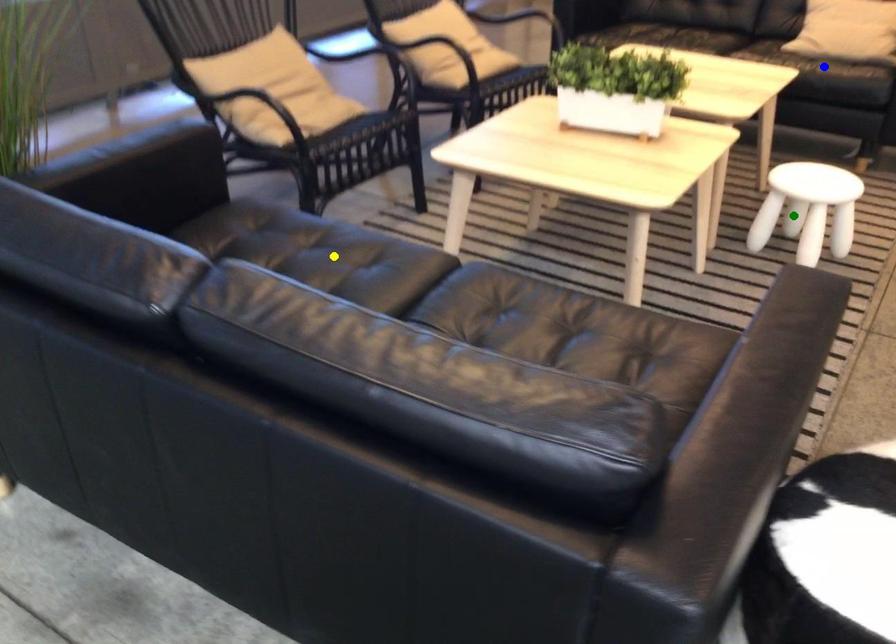
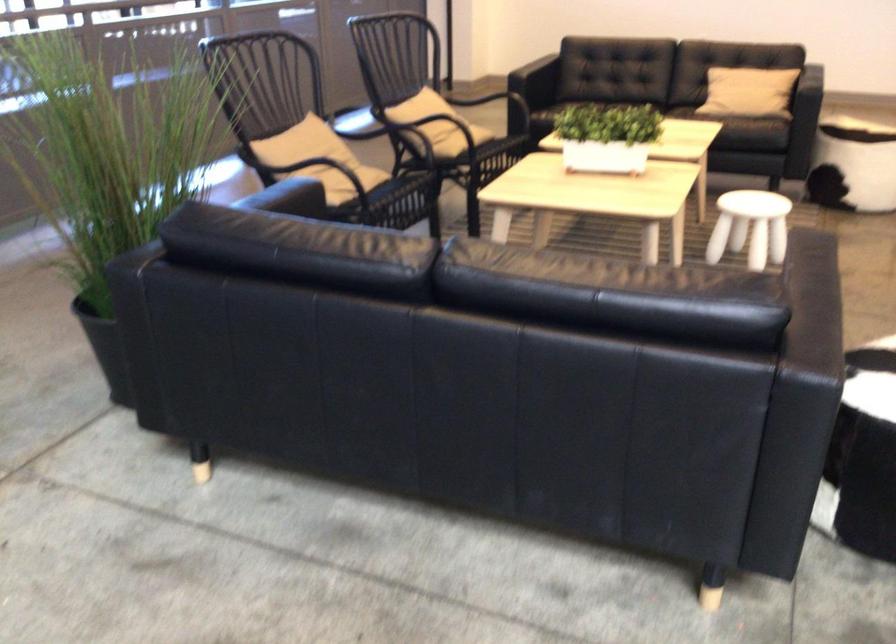
I am providing you with two images of the same scene from different viewpoints. Three points are marked in image1. Which point corresponds to a part or object that is occluded in image2?In image1, three points are marked. Which of them correspond to a part or object that is occluded in image2?Among the three points shown in image1, which one corresponds to a part or object that is no longer visible due to occlusion in image2?

yellow point